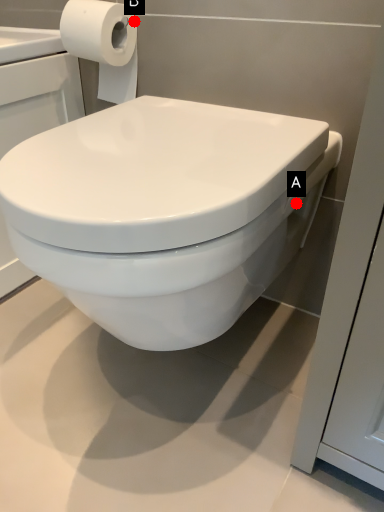
Question: Two points are circled on the image, labeled by A and B beside each circle. Which of the following is the closest to the observer?

Choices:
 (A) A is closer
 (B) B is closer

Answer: (A)